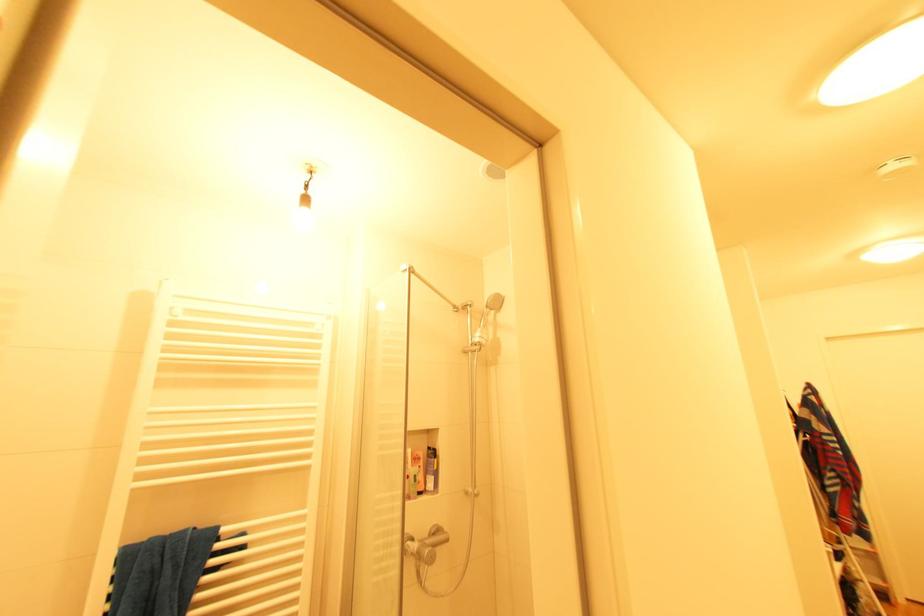
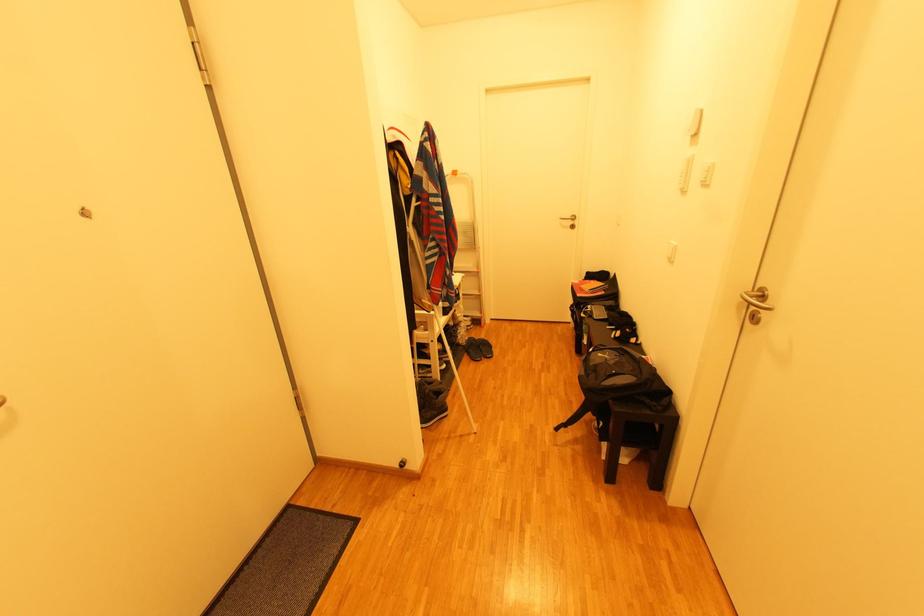
Where in the second image is the point corresponding to (882,583) from the first image?

(481, 315)